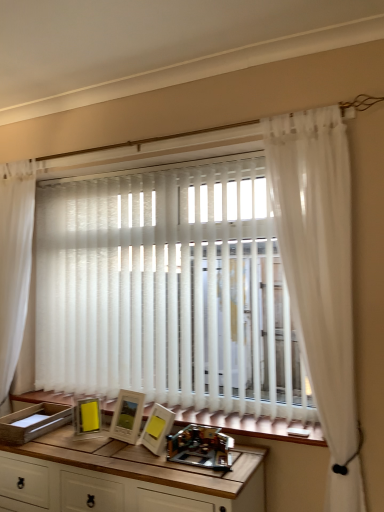
The width and height of the screenshot is (384, 512). Find the location of `free space above wooden at lower center (from a real-world perspective)`. free space above wooden at lower center (from a real-world perspective) is located at coordinates (x=169, y=404).